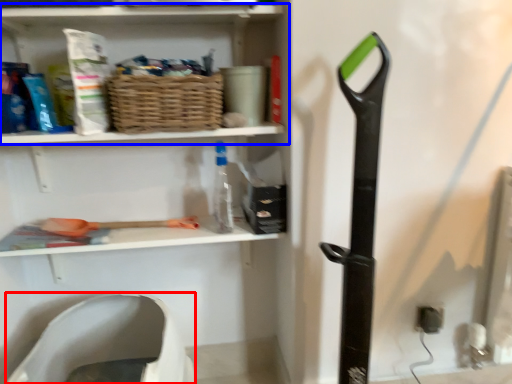
Question: Which point is further to the camera, wide (highlighted by a red box) or shelf (highlighted by a blue box)?

Choices:
 (A) wide
 (B) shelf

Answer: (B)